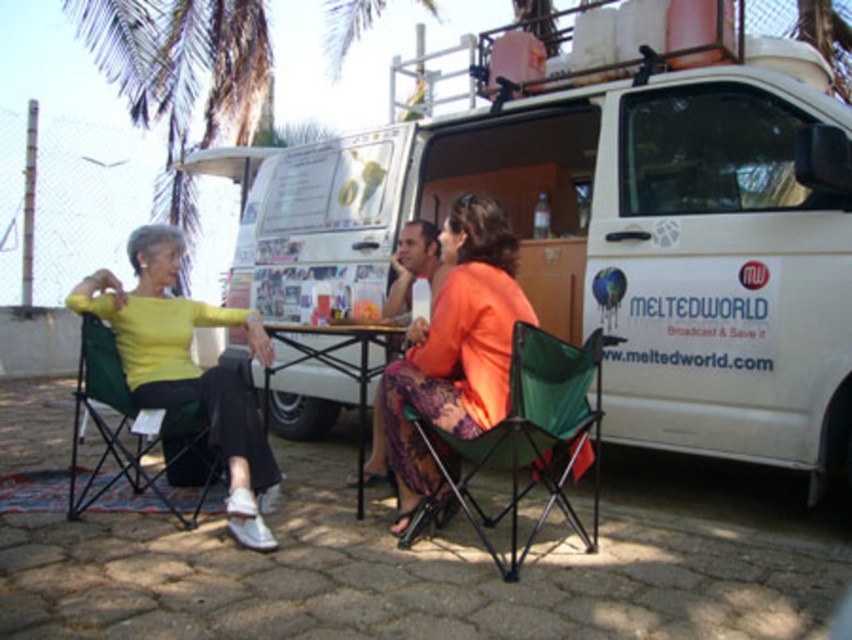
You are setting up a booth for an event and need to place a 1.2 meter wide banner between the white matte van at center and the matte plastic cup at center. Can the banner fit between them?

The white matte van at center is wider than the matte plastic cup at center. However, the banner requires 1.2 meters of space. Since the description only states the van is wider than the cup but doesn not provide exact measurements, we cannot determine if the banner will fit. More information is needed about the actual dimensions of both objects.

You are standing at the origin point of the coordinate system in the image. You see a point at coordinates (187,371). Which object is this point located on?

The point at coordinates (187,371) is located on the yellow matte sweater at left.

You are a photographer trying to capture a photo of the yellow matte sweater at left and the orange fabric dress at center. Which one should you focus on first if you want to ensure both are in focus without adjusting your camera settings?

The yellow matte sweater at left is below the orange fabric dress at center, so focusing on the orange fabric dress at center first will help ensure both are in focus since it is closer to the camera.